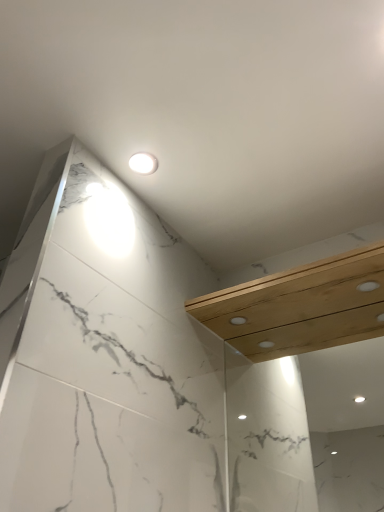
Measure the distance between point (235, 333) and camera.

A distance of 1.51 meters exists between point (235, 333) and camera.

The height and width of the screenshot is (512, 384). What do you see at coordinates (301, 307) in the screenshot?
I see `natural wood balustrade at upper right` at bounding box center [301, 307].

The image size is (384, 512). What are the coordinates of `natural wood balustrade at upper right` in the screenshot? It's located at (301, 307).

Consider the image. What is the approximate height of white glossy light fixture at upper center?

white glossy light fixture at upper center is 0.95 inches tall.

At what (x,y) coordinates should I click in order to perform the action: click on white glossy light fixture at upper center. Please return your answer as a coordinate pair (x, y). Looking at the image, I should click on (143, 163).

Measure the distance between point (x=139, y=169) and camera.

Point (x=139, y=169) and camera are 4.19 feet apart from each other.

Describe the element at coordinates (143, 163) in the screenshot. I see `white glossy light fixture at upper center` at that location.

Locate an element on the screen. natural wood balustrade at upper right is located at coordinates (301, 307).

Consider the image. Considering the relative positions of natural wood balustrade at upper right and white glossy light fixture at upper center in the image provided, is natural wood balustrade at upper right to the left or to the right of white glossy light fixture at upper center?

Based on their positions, natural wood balustrade at upper right is located to the right of white glossy light fixture at upper center.

Is the depth of natural wood balustrade at upper right greater than that of white glossy light fixture at upper center?

No, it is in front of white glossy light fixture at upper center.

Considering the points (255, 324) and (141, 164), which point is behind, point (255, 324) or point (141, 164)?

The point (255, 324) is farther.

Consider the image. From the image's perspective, is natural wood balustrade at upper right below white glossy light fixture at upper center?

Yes, from the image's perspective, natural wood balustrade at upper right is beneath white glossy light fixture at upper center.

Looking at this image, from a real-world perspective, which is physically below, natural wood balustrade at upper right or white glossy light fixture at upper center?

natural wood balustrade at upper right, from a real-world perspective.

Does natural wood balustrade at upper right have a lesser width compared to white glossy light fixture at upper center?

No, natural wood balustrade at upper right is not thinner than white glossy light fixture at upper center.

Between natural wood balustrade at upper right and white glossy light fixture at upper center, which one has more height?

Standing taller between the two is natural wood balustrade at upper right.

Considering the relative sizes of natural wood balustrade at upper right and white glossy light fixture at upper center in the image provided, is natural wood balustrade at upper right smaller than white glossy light fixture at upper center?

No, natural wood balustrade at upper right is not smaller than white glossy light fixture at upper center.

Is natural wood balustrade at upper right inside or outside of white glossy light fixture at upper center?

natural wood balustrade at upper right cannot be found inside white glossy light fixture at upper center.

Would you say natural wood balustrade at upper right is a long distance from white glossy light fixture at upper center?

They are positioned close to each other.

Is white glossy light fixture at upper center at the back of natural wood balustrade at upper right?

natural wood balustrade at upper right is not turned away from white glossy light fixture at upper center.

The width and height of the screenshot is (384, 512). I want to click on balustrade located underneath the white glossy light fixture at upper center (from a real-world perspective), so click(301, 307).

Can you confirm if white glossy light fixture at upper center is positioned to the right of natural wood balustrade at upper right?

Incorrect, white glossy light fixture at upper center is not on the right side of natural wood balustrade at upper right.

Which object is further away from the camera taking this photo, white glossy light fixture at upper center or natural wood balustrade at upper right?

white glossy light fixture at upper center is further away from the camera.

Is point (151, 154) farther from camera compared to point (295, 296)?

No.

From the image's perspective, would you say white glossy light fixture at upper center is positioned over natural wood balustrade at upper right?

Yes, from the image's perspective, white glossy light fixture at upper center is over natural wood balustrade at upper right.

From a real-world perspective, does white glossy light fixture at upper center stand above natural wood balustrade at upper right?

Yes, from a real-world perspective, white glossy light fixture at upper center is over natural wood balustrade at upper right

Does white glossy light fixture at upper center have a lesser width compared to natural wood balustrade at upper right?

Yes.

Considering the sizes of objects white glossy light fixture at upper center and natural wood balustrade at upper right in the image provided, who is taller, white glossy light fixture at upper center or natural wood balustrade at upper right?

With more height is natural wood balustrade at upper right.

Considering the relative sizes of white glossy light fixture at upper center and natural wood balustrade at upper right in the image provided, is white glossy light fixture at upper center smaller than natural wood balustrade at upper right?

Indeed, white glossy light fixture at upper center has a smaller size compared to natural wood balustrade at upper right.

Is white glossy light fixture at upper center located outside natural wood balustrade at upper right?

Absolutely, white glossy light fixture at upper center is external to natural wood balustrade at upper right.

From the picture: Would you consider white glossy light fixture at upper center to be distant from natural wood balustrade at upper right?

Actually, white glossy light fixture at upper center and natural wood balustrade at upper right are a little close together.

Is white glossy light fixture at upper center facing away from natural wood balustrade at upper right?

No, white glossy light fixture at upper center is not facing the opposite direction of natural wood balustrade at upper right.

How different are the orientations of white glossy light fixture at upper center and natural wood balustrade at upper right in degrees?

The angular difference between white glossy light fixture at upper center and natural wood balustrade at upper right is 0.632 degrees.

Locate an element on the screen. light fixture that appears on the left of natural wood balustrade at upper right is located at coordinates (143, 163).

Find the location of `balustrade in front of the white glossy light fixture at upper center`. balustrade in front of the white glossy light fixture at upper center is located at coordinates (301, 307).

The height and width of the screenshot is (512, 384). I want to click on light fixture behind the natural wood balustrade at upper right, so click(x=143, y=163).